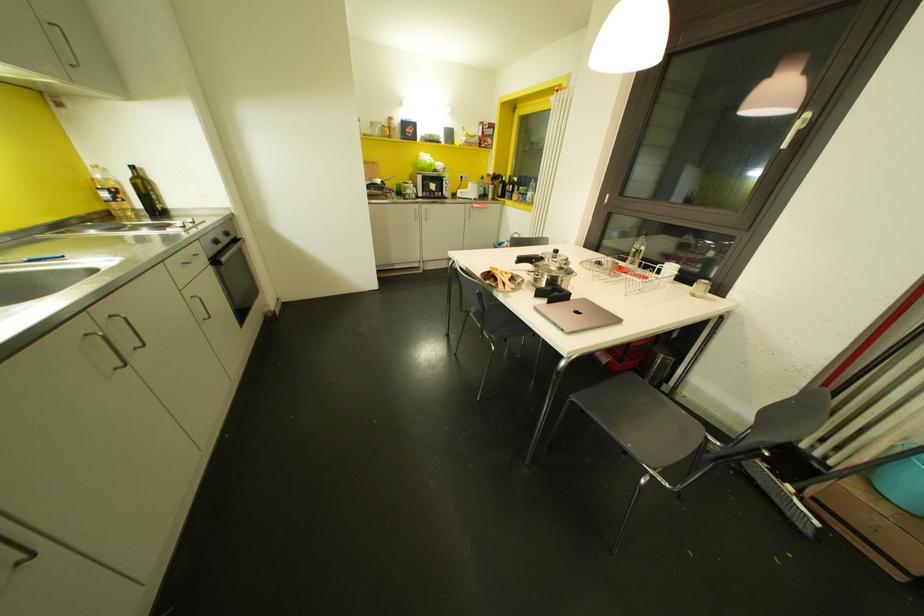
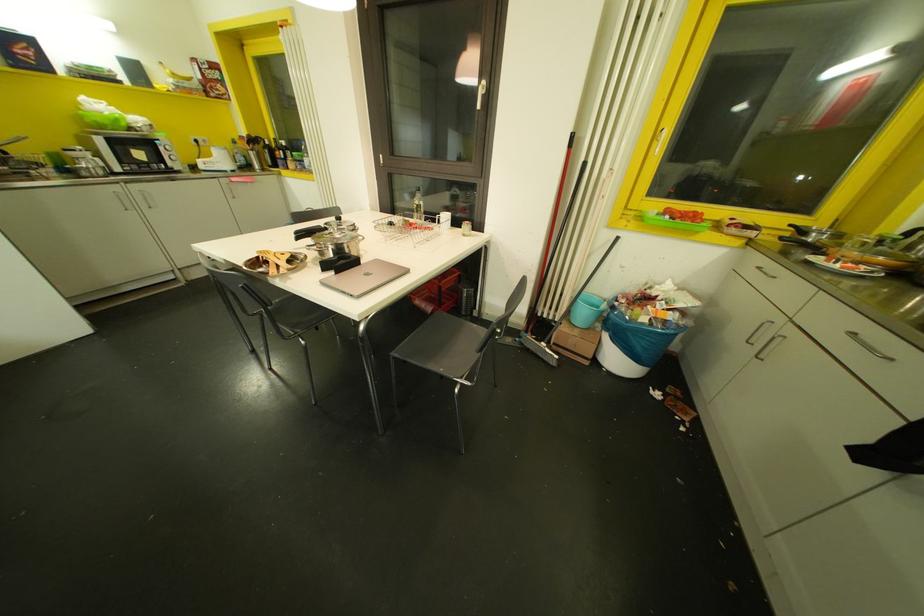
Find the pixel in the second image that matches [658,272] in the first image.

(441, 222)